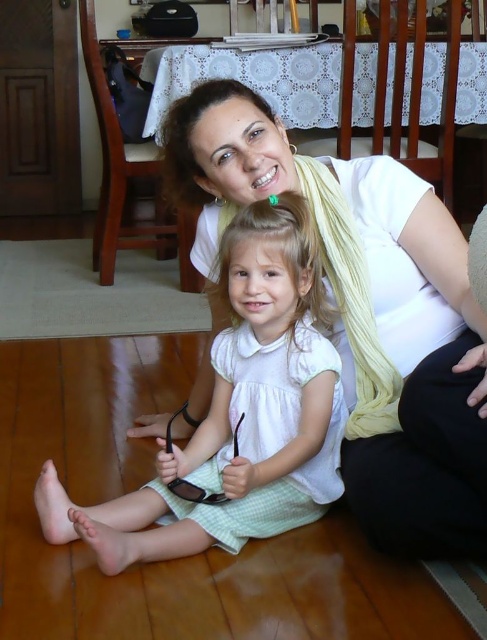
Consider the image. Who is more forward, (x=450, y=317) or (x=165, y=545)?

Positioned in front is point (x=165, y=545).

Is white matte scarf at upper center above white cotton dress at center?

Yes.

Find the location of a particular element. white matte scarf at upper center is located at coordinates (366, 314).